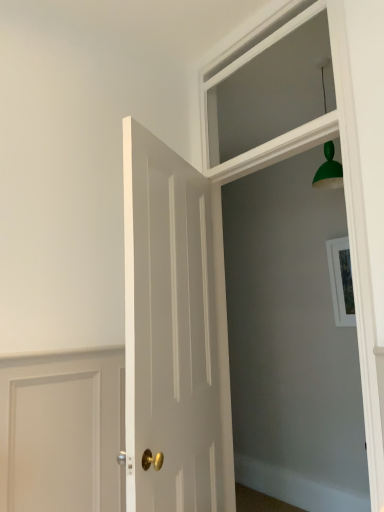
Describe the element at coordinates (269, 92) in the screenshot. I see `clear glass window at upper center` at that location.

Identify the location of white glossy door at center. (174, 332).

Is white glossy door at center at the back of clear glass window at upper center?

No, clear glass window at upper center is not facing away from white glossy door at center.

Is clear glass window at upper center positioned beyond the bounds of white glossy door at center?

Yes, clear glass window at upper center is located beyond the bounds of white glossy door at center.

Relative to white glossy door at center, is clear glass window at upper center in front or behind?

In the image, clear glass window at upper center appears behind white glossy door at center.

Does clear glass window at upper center touch white glossy door at center?

No, clear glass window at upper center is not making contact with white glossy door at center.

Considering the sizes of objects white wood frame at upper center and clear glass window at upper center in the image provided, who is smaller, white wood frame at upper center or clear glass window at upper center?

With smaller size is clear glass window at upper center.

Does point (374, 466) appear closer or farther from the camera than point (249, 121)?

Point (374, 466) is closer to the camera than point (249, 121).

Considering the sizes of objects white wood frame at upper center and clear glass window at upper center in the image provided, who is thinner, white wood frame at upper center or clear glass window at upper center?

clear glass window at upper center.

Is the position of white glossy door at center more distant than that of white wood frame at upper center?

No, white glossy door at center is closer to the viewer.

From a real-world perspective, which is physically above, white glossy door at center or white wood frame at upper center?

From a 3D spatial view, white glossy door at center is above.

Which of these two, white glossy door at center or white wood frame at upper center, stands taller?

white wood frame at upper center.

From the image's perspective, which object appears higher, white glossy door at center or white wood frame at upper center?

white glossy door at center is shown above in the image.

Is white glossy door at center at the right side of clear glass window at upper center?

No.

Between white glossy door at center and clear glass window at upper center, which one has smaller size?

clear glass window at upper center.

From the image's perspective, which is above, white glossy door at center or clear glass window at upper center?

clear glass window at upper center, from the image's perspective.

Considering the relative sizes of white glossy door at center and clear glass window at upper center in the image provided, is white glossy door at center shorter than clear glass window at upper center?

In fact, white glossy door at center may be taller than clear glass window at upper center.

Is clear glass window at upper center at the left side of white wood frame at upper center?

Indeed, clear glass window at upper center is positioned on the left side of white wood frame at upper center.

What's the angular difference between clear glass window at upper center and white wood frame at upper center's facing directions?

The angular difference between clear glass window at upper center and white wood frame at upper center is 0.00242 degrees.

In terms of width, does clear glass window at upper center look wider or thinner when compared to white wood frame at upper center?

In the image, clear glass window at upper center appears to be more narrow than white wood frame at upper center.

Who is smaller, white wood frame at upper center or white glossy door at center?

white wood frame at upper center.

In terms of width, does white wood frame at upper center look wider or thinner when compared to white glossy door at center?

In the image, white wood frame at upper center appears to be more narrow than white glossy door at center.

You are a GUI agent. You are given a task and a screenshot of the screen. Output one action in this format:
    pyautogui.click(x=<x>, y=<y>)
    Task: Click on the door lying above the white wood frame at upper center (from the image's perspective)
    The width and height of the screenshot is (384, 512).
    Given the screenshot: What is the action you would take?
    pyautogui.click(x=174, y=332)

Find the location of a particular element. The image size is (384, 512). door below the clear glass window at upper center (from a real-world perspective) is located at coordinates (174, 332).

In order to click on window above the white wood frame at upper center (from a real-world perspective) in this screenshot , I will do `click(269, 92)`.

Looking at the image, which one is located closer to white wood frame at upper center, white glossy door at center or clear glass window at upper center?

The object closer to white wood frame at upper center is clear glass window at upper center.

Estimate the real-world distances between objects in this image. Which object is closer to white glossy door at center, clear glass window at upper center or white wood frame at upper center?

white wood frame at upper center is closer to white glossy door at center.

Which object lies further to the anchor point clear glass window at upper center, white glossy door at center or white wood frame at upper center?

white glossy door at center is positioned further to the anchor clear glass window at upper center.

When comparing their distances from white wood frame at upper center, does clear glass window at upper center or white glossy door at center seem closer?

clear glass window at upper center.

Which object lies nearer to the anchor point white glossy door at center, white wood frame at upper center or clear glass window at upper center?

white wood frame at upper center is positioned closer to the anchor white glossy door at center.

When comparing their distances from clear glass window at upper center, does white wood frame at upper center or white glossy door at center seem closer?

The object closer to clear glass window at upper center is white wood frame at upper center.

I want to click on door between clear glass window at upper center and white wood frame at upper center in the up-down direction, so [174, 332].